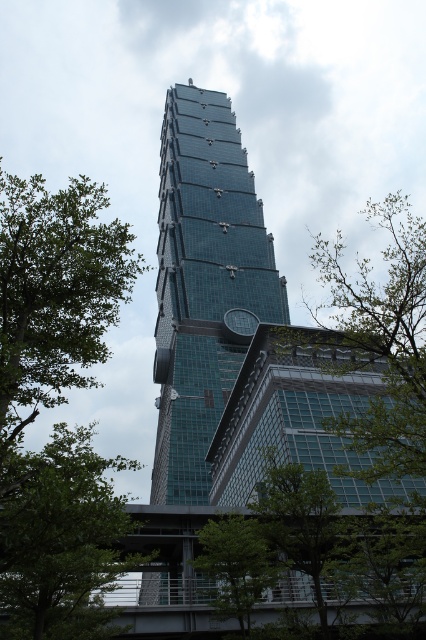
You are standing at the center of the image. Which direction should you move to get closer to the green leafy tree at left?

The green leafy tree at left is located at point 0.456 on the x axis and 0.131 on the y axis. Since you are at the center, you should move towards the left direction to get closer to the green leafy tree at left.

You are standing at point (60, 540) in the image of the modern skyscraper. What can you see in that location?

At point (60, 540), there is a green leafy tree at lower left.